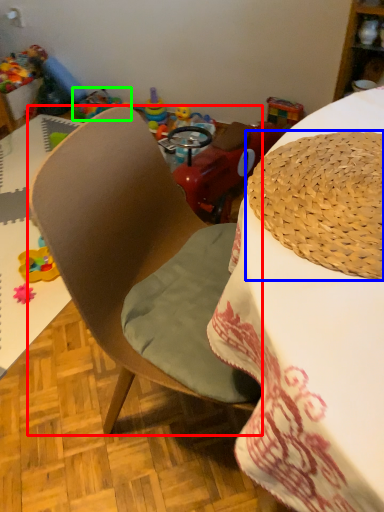
Question: Estimate the real-world distances between objects in this image. Which object is closer to chair (highlighted by a red box), hat (highlighted by a blue box) or toy (highlighted by a green box)?

Choices:
 (A) hat
 (B) toy

Answer: (A)